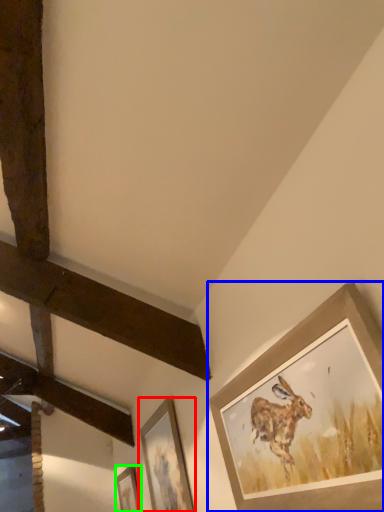
Question: Which object is the closest to the picture frame (highlighted by a red box)? Choose among these: picture frame (highlighted by a blue box) or picture frame (highlighted by a green box).

Choices:
 (A) picture frame
 (B) picture frame

Answer: (B)